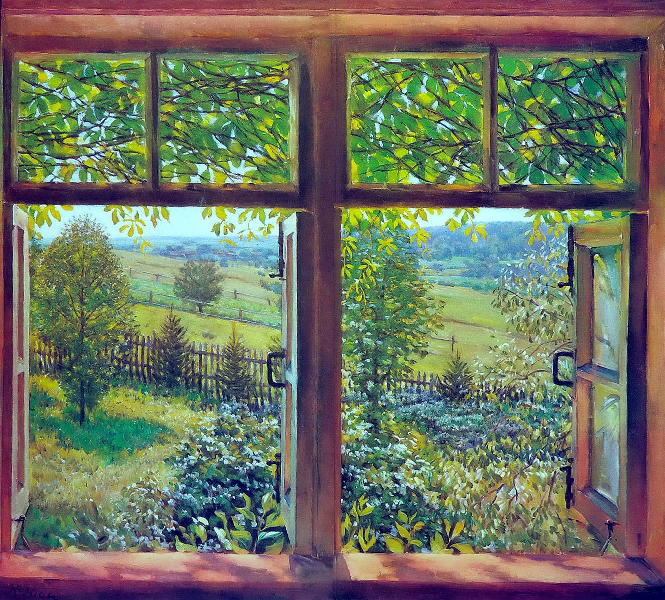
Where is `top part of window frame`? The image size is (665, 600). top part of window frame is located at coordinates (529, 33).